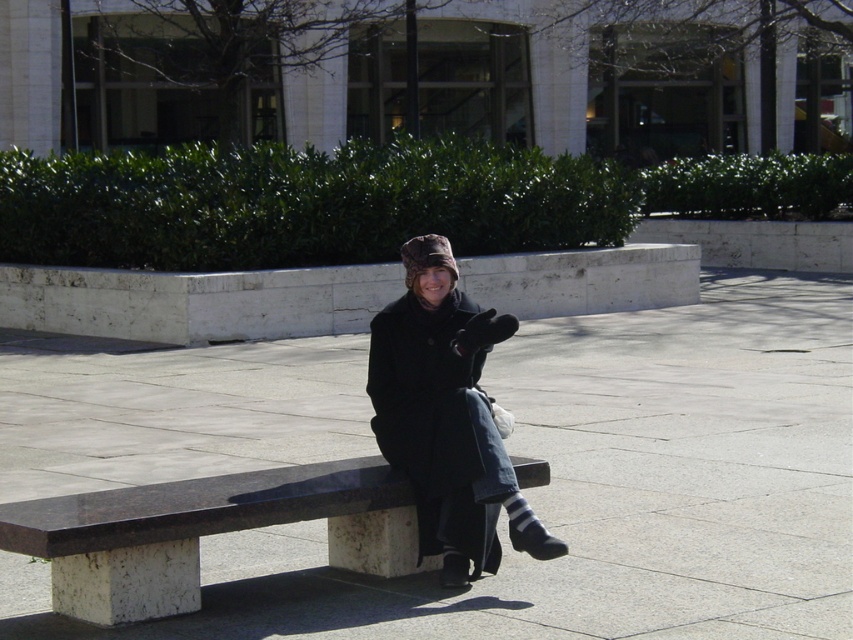
Is point (265, 500) more distant than point (494, 522)?

That is False.

Can you confirm if dark brown polished wood bench at center is wider than black woolen coat at center?

Indeed, dark brown polished wood bench at center has a greater width compared to black woolen coat at center.

Does point (349, 512) come closer to viewer compared to point (428, 312)?

Yes, it is in front of point (428, 312).

Identify the location of dark brown polished wood bench at center. The image size is (853, 640). (206, 532).